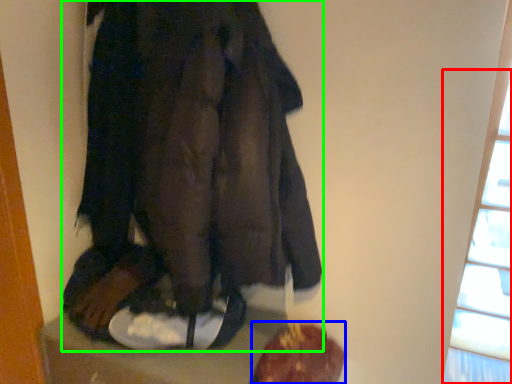
Question: Based on their relative distances, which object is nearer to window (highlighted by a red box)? Choose from food (highlighted by a blue box) and fancy dress (highlighted by a green box).

Choices:
 (A) food
 (B) fancy dress

Answer: (A)